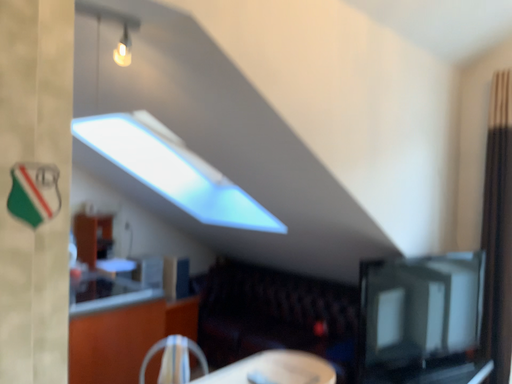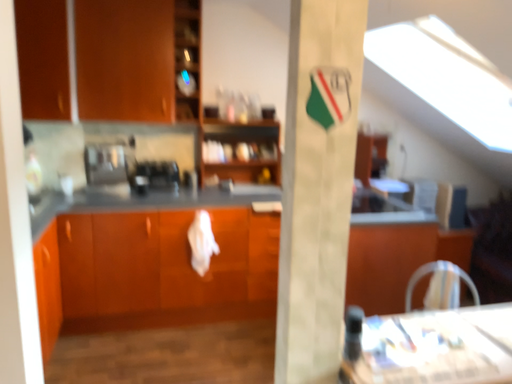
Question: Which way did the camera rotate in the video?

Choices:
 (A) rotated left
 (B) rotated right

Answer: (A)